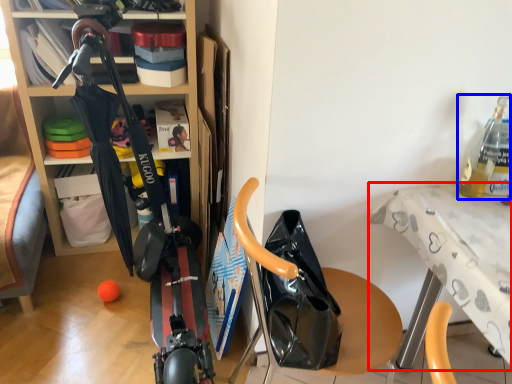
Question: Which object appears closest to the camera in this image, table (highlighted by a red box) or bottle (highlighted by a blue box)?

Choices:
 (A) table
 (B) bottle

Answer: (A)